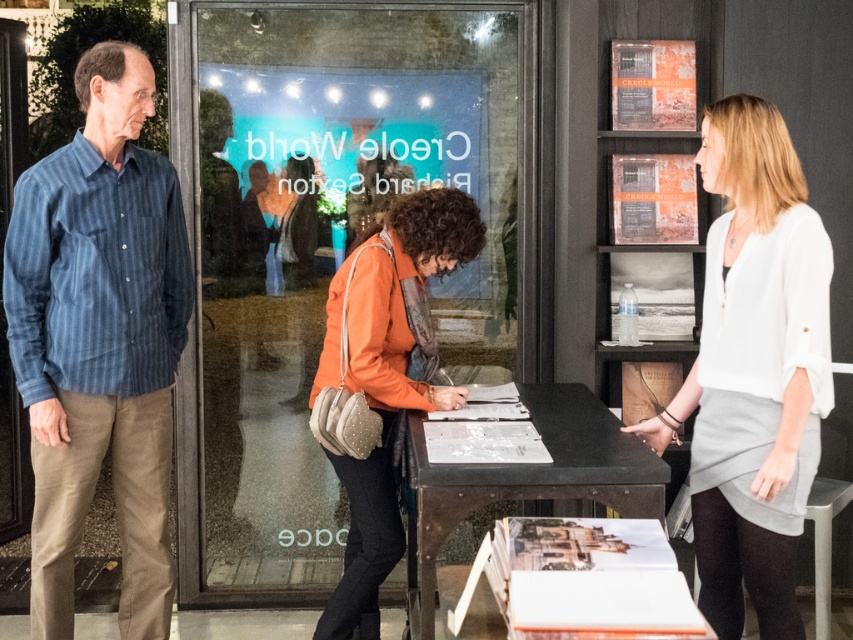
Question: Is orange fabric jacket at center wider than black metal table at center?

Choices:
 (A) no
 (B) yes

Answer: (A)

Question: Does orange fabric jacket at center appear on the left side of black metal table at center?

Choices:
 (A) no
 (B) yes

Answer: (B)

Question: Which of the following is the closest to the observer?

Choices:
 (A) transparent glass shop window at center
 (B) white matte blouse at center
 (C) black metal table at center
 (D) orange fabric jacket at center

Answer: (C)

Question: Which of the following is the farthest from the observer?

Choices:
 (A) white matte blouse at center
 (B) orange fabric jacket at center
 (C) transparent glass shop window at center

Answer: (C)

Question: Is transparent glass shop window at center to the right of blue striped shirt at left from the viewer's perspective?

Choices:
 (A) no
 (B) yes

Answer: (B)

Question: Which of these objects is positioned closest to the orange fabric jacket at center?

Choices:
 (A) white matte blouse at center
 (B) black metal table at center

Answer: (B)